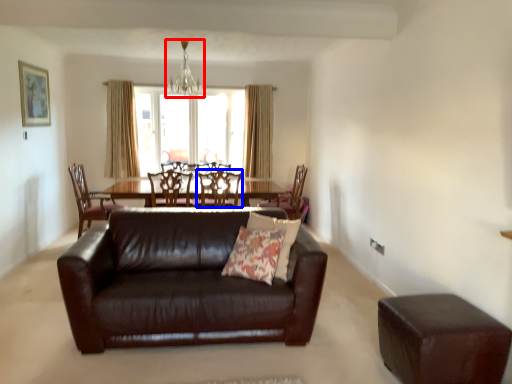
Question: Which object is further to the camera taking this photo, light fixture (highlighted by a red box) or chair (highlighted by a blue box)?

Choices:
 (A) light fixture
 (B) chair

Answer: (A)